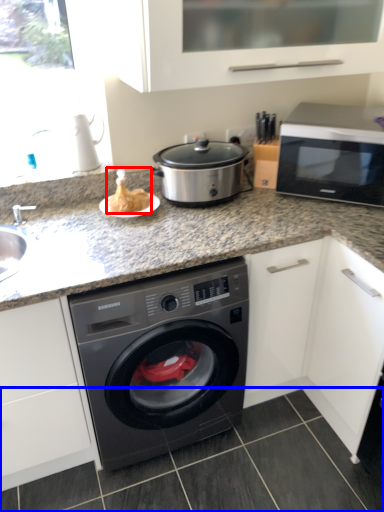
Question: Which object is further to the camera taking this photo, food (highlighted by a red box) or tile (highlighted by a blue box)?

Choices:
 (A) food
 (B) tile

Answer: (A)